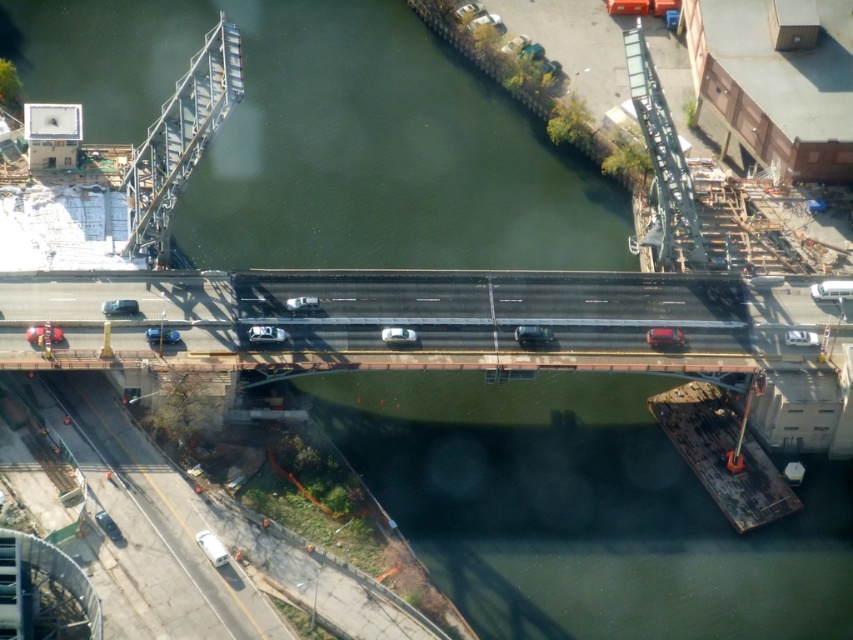
You are a drone operator trying to capture a photo of the bridge from above. You notice two points marked on your screen at coordinates point (160, 337) and point (457, 19). Which point is closer to your camera lens?

Point (160, 337) is closer to the camera lens than point (457, 19).

You are a pedestrian standing on the bridge and want to cross to the other side. There are two cars nearby, a shiny silver sedan at lower left and a white glossy sedan at center. Which car is closer to your left side?

The shiny silver sedan at lower left is to the left of the white glossy sedan at center, so it is closer to your left side.

You are a drone operator trying to capture a photo of the white glossy car at center from above. What are the coordinates where you should position the camera to ensure the car is centered in the frame?

The white glossy car at center is located at coordinates point (265, 333), so you should position the camera at those coordinates to center it in the frame.